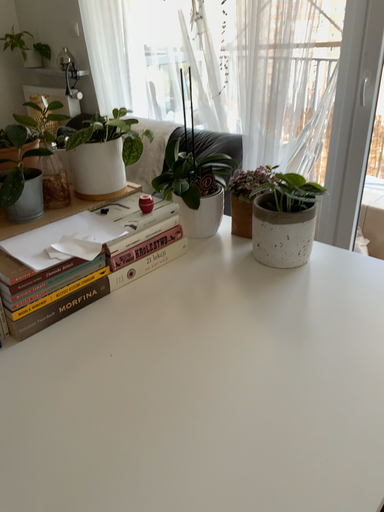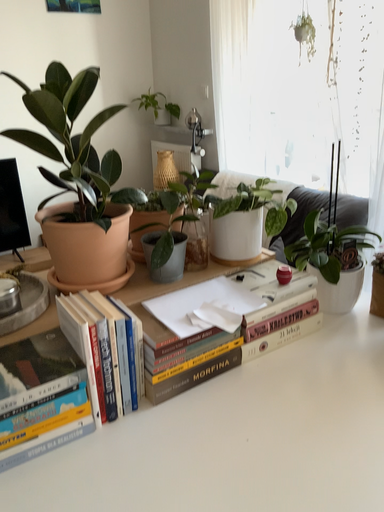
Question: How did the camera likely rotate when shooting the video?

Choices:
 (A) rotated downward
 (B) rotated upward

Answer: (B)